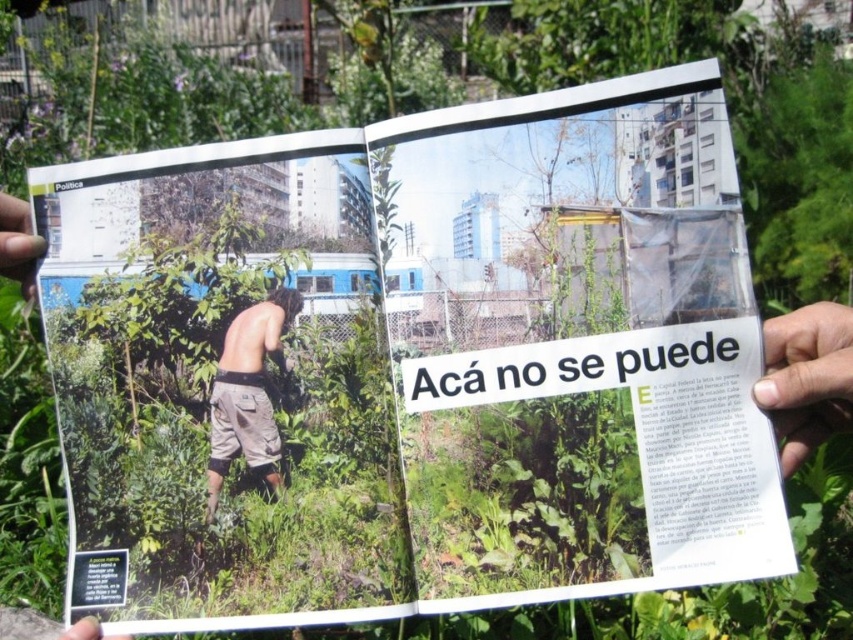
You are a photographer trying to capture both the dark skin hand at right and the smooth skin hand at upper left in a single frame. Which hand should you focus on first if you want to ensure both are in the frame without moving the camera?

You should focus on the dark skin hand at right first because it is wider than the smooth skin hand at upper left, so capturing it first ensures there is enough space for both in the frame.

You are a photographer trying to capture the dark skin hand at right in the magazine. Where should you focus your camera to ensure the hand is in the frame?

The dark skin hand at right is located at point coordinates 0.592 on the x axis and 0.946 on the y axis, so focus the camera at those coordinates to capture the hand.

You are a drone operator trying to capture aerial footage of the magazine pages. You have two points marked on your screen for camera positioning. Which point is closer to the camera lens? The points are point 1 at coordinates point (773, 384) and point 2 at coordinates point (257, 369).

Point 1 at coordinates point (773, 384) is in front of point 2 at coordinates point (257, 369), so it is closer to the camera lens.